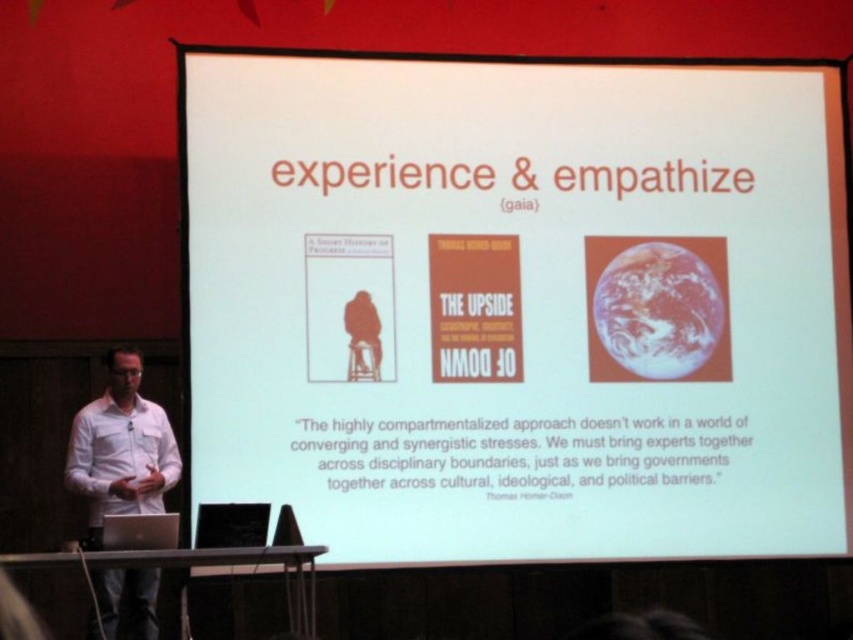
You are an attendee at the presentation and need to take notes. The speaker is pointing to the white paper at center. Where should you look to see what the speaker is referring to?

The speaker is pointing to the white paper at center, which is located at coordinates point (519, 305). You should look at the white paper at center positioned at that point to see what the speaker is referring to.